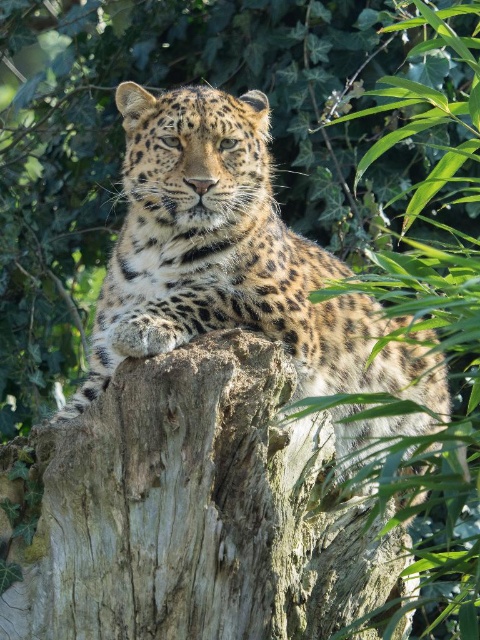
You are a wildlife photographer aiming to capture a closeup shot of the spotted fur leopard at center. Your camera has a minimum focusing distance of 1 meter. Can you take the photo without moving closer than 1 meter from the brown rough bark at center?

The brown rough bark at center is 1.05 meters from the spotted fur leopard at center. Since your camera requires at least 1 meter to focus, you can take the photo by positioning yourself 1.05 meters away from the brown rough bark at center, which is just beyond the minimum focusing distance.